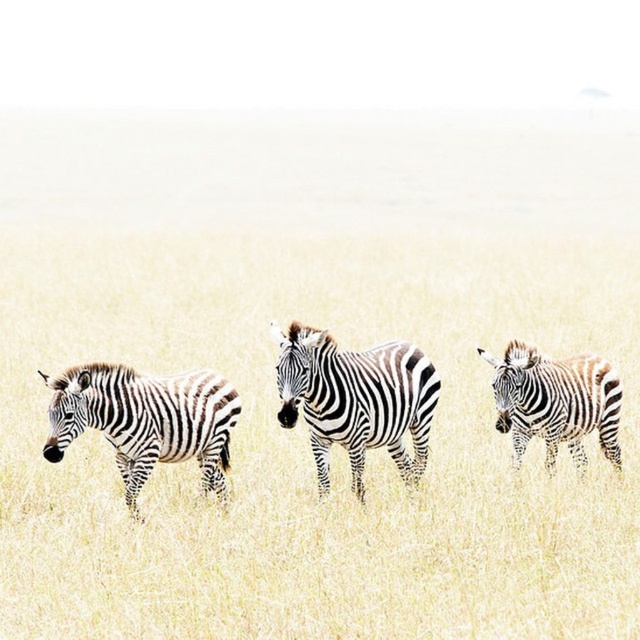
In the scene shown: You are a photographer aiming to capture the entire scene of the black and white striped zebra at center and the white grassland at center in one shot. Based on their widths, which one would require you to adjust your camera angle more to ensure both fit in the frame?

The white grassland at center has a greater width than the black and white striped zebra at center, so you would need to adjust your camera angle more to accommodate the wider white grassland at center.

Looking at this image, you are a wildlife photographer trying to capture a photo of the zebras in the savanna. You notice two groups of black and white striped zebras at center and black and white striped zebra at center. Which group is smaller in size?

The black and white striped zebras at center has a smaller size compared to the black and white striped zebra at center, so the group of black and white striped zebras at center is smaller.

Looking at this image, you are a photographer trying to capture the entire scene of the black and white striped zebras at center and the white grassland at center in one shot. Given that your camera frame can only accommodate objects with a combined width of 10 meters, will both fit within the frame?

The white grassland at center is wider than the black and white striped zebras at center. However, since the exact widths are not provided, we cannot determine if their combined width exceeds 10 meters. Please check the individual widths to ensure they fit within the frame.